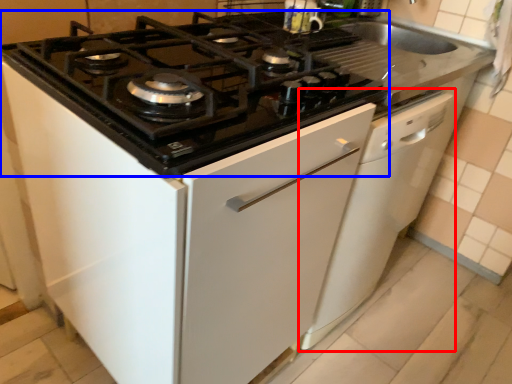
Question: Which of the following is the farthest to the observer, dish washer (highlighted by a red box) or gas stove (highlighted by a blue box)?

Choices:
 (A) dish washer
 (B) gas stove

Answer: (A)